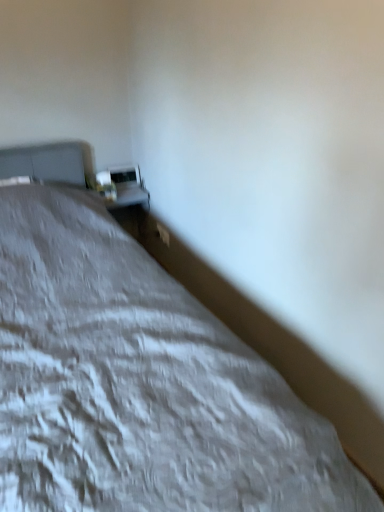
Question: Is white glossy table at upper center not inside matte white table lamp at upper left?

Choices:
 (A) no
 (B) yes

Answer: (B)

Question: Considering the relative sizes of white glossy table at upper center and matte white table lamp at upper left in the image provided, is white glossy table at upper center bigger than matte white table lamp at upper left?

Choices:
 (A) no
 (B) yes

Answer: (B)

Question: From a real-world perspective, is white glossy table at upper center on matte white table lamp at upper left?

Choices:
 (A) yes
 (B) no

Answer: (B)

Question: From the image's perspective, is white glossy table at upper center on top of matte white table lamp at upper left?

Choices:
 (A) yes
 (B) no

Answer: (B)

Question: Are white glossy table at upper center and matte white table lamp at upper left far apart?

Choices:
 (A) no
 (B) yes

Answer: (A)

Question: Considering the relative positions of white glossy table at upper center and matte white table lamp at upper left in the image provided, is white glossy table at upper center in front of matte white table lamp at upper left?

Choices:
 (A) no
 (B) yes

Answer: (A)

Question: Is white textured bed at center wider than white glossy table at upper center?

Choices:
 (A) no
 (B) yes

Answer: (B)

Question: Is the position of white textured bed at center more distant than that of white glossy table at upper center?

Choices:
 (A) no
 (B) yes

Answer: (A)

Question: Does white textured bed at center turn towards white glossy table at upper center?

Choices:
 (A) no
 (B) yes

Answer: (A)

Question: Is white textured bed at center thinner than white glossy table at upper center?

Choices:
 (A) yes
 (B) no

Answer: (B)

Question: Is white textured bed at center not within white glossy table at upper center?

Choices:
 (A) yes
 (B) no

Answer: (A)

Question: Considering the relative sizes of white textured bed at center and white glossy table at upper center in the image provided, is white textured bed at center bigger than white glossy table at upper center?

Choices:
 (A) yes
 (B) no

Answer: (A)

Question: Can you confirm if matte white table lamp at upper left is shorter than white textured bed at center?

Choices:
 (A) no
 (B) yes

Answer: (B)